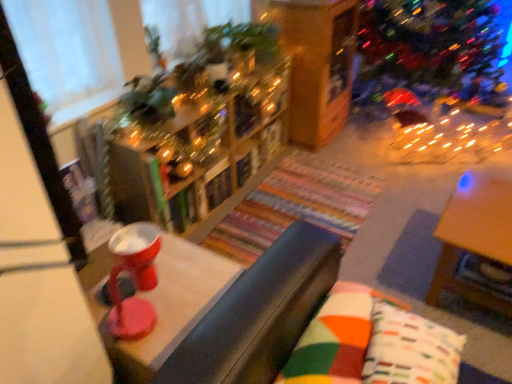
Find the location of a particular element. This screenshot has width=512, height=384. shiny plastic bowl at center, the 2th table in the right-to-left sequence is located at coordinates (160, 302).

Describe the element at coordinates (160, 302) in the screenshot. I see `shiny plastic bowl at center, the 2th table in the right-to-left sequence` at that location.

The height and width of the screenshot is (384, 512). What do you see at coordinates (317, 65) in the screenshot?
I see `wooden bookshelf at center` at bounding box center [317, 65].

In order to face multicolored fabric pillow at lower right, which ranks as the 2th pillow in left-to-right order, should I rotate leftwards or rightwards?

To face it directly, rotate right by 21.220 degrees.

Locate an element on the screen. wooden table at right, acting as the 2th table starting from the left is located at coordinates (475, 235).

What is the approximate width of wooden table at right, the 1th table when ordered from right to left?

The width of wooden table at right, the 1th table when ordered from right to left, is 54.92 centimeters.

The width and height of the screenshot is (512, 384). Identify the location of shiny plastic bowl at center, the 1th table when ordered from left to right. (160, 302).

Is multicolored fabric pillow at lower right, which ranks as the 2th pillow in left-to-right order, oriented away from shiny plastic bowl at center, the 1th table when ordered from left to right?

Yes, multicolored fabric pillow at lower right, which ranks as the 2th pillow in left-to-right order,'s orientation is away from shiny plastic bowl at center, the 1th table when ordered from left to right.

What are the coordinates of `table on the left of multicolored fabric pillow at lower right, which ranks as the 2th pillow in left-to-right order` in the screenshot? It's located at (160, 302).

Does multicolored fabric pillow at lower right, which ranks as the 2th pillow in left-to-right order, come behind shiny plastic bowl at center, the 1th table when ordered from left to right?

No, the depth of multicolored fabric pillow at lower right, which ranks as the 2th pillow in left-to-right order, is less than that of shiny plastic bowl at center, the 1th table when ordered from left to right.

Considering the sizes of multicolored fabric pillow at lower right, acting as the first pillow starting from the right, and shiny plastic bowl at center, the 1th table when ordered from left to right, in the image, is multicolored fabric pillow at lower right, acting as the first pillow starting from the right, wider or thinner than shiny plastic bowl at center, the 1th table when ordered from left to right,?

Considering their sizes, multicolored fabric pillow at lower right, acting as the first pillow starting from the right, looks slimmer than shiny plastic bowl at center, the 1th table when ordered from left to right.

The width and height of the screenshot is (512, 384). Identify the location of the 2nd table below when counting from the wooden bookshelf at center (from the image's perspective). (160, 302).

Is wooden bookshelf at center far away from shiny plastic bowl at center, the 1th table when ordered from left to right?

No.

Can you confirm if wooden bookshelf at center is bigger than shiny plastic bowl at center, the 2th table in the right-to-left sequence?

Incorrect, wooden bookshelf at center is not larger than shiny plastic bowl at center, the 2th table in the right-to-left sequence.

What's the angular difference between shiny plastic bowl at center, the 1th table when ordered from left to right, and wooden bookshelf at center's facing directions?

They differ by 92.5 degrees in their facing directions.

In the scene shown: Is the depth of shiny plastic bowl at center, the 2th table in the right-to-left sequence, less than that of wooden bookshelf at center?

Yes, it is.

Considering the relative sizes of shiny plastic bowl at center, the 1th table when ordered from left to right, and wooden bookshelf at center in the image provided, is shiny plastic bowl at center, the 1th table when ordered from left to right, smaller than wooden bookshelf at center?

Yes.

From a real-world perspective, relative to wooden bookshelf at center, is shiny plastic bowl at center, the 1th table when ordered from left to right, vertically above or below?

Clearly, from a real-world perspective, shiny plastic bowl at center, the 1th table when ordered from left to right, is below wooden bookshelf at center.

Which point is more forward, (x=314, y=10) or (x=465, y=220)?

The point (x=465, y=220) is in front.

From their relative heights in the image, would you say wooden bookshelf at center is taller or shorter than wooden table at right, acting as the 2th table starting from the left?

In the image, wooden bookshelf at center appears to be taller than wooden table at right, acting as the 2th table starting from the left.

From the picture: What's the angular difference between wooden bookshelf at center and wooden table at right, acting as the 2th table starting from the left,'s facing directions?

The angle between the facing direction of wooden bookshelf at center and the facing direction of wooden table at right, acting as the 2th table starting from the left, is 91.3 degrees.

From the picture: Is wooden bookshelf at center facing towards wooden table at right, acting as the 2th table starting from the left?

No, wooden bookshelf at center does not turn towards wooden table at right, acting as the 2th table starting from the left.

Does multicolored fabric pillow at center, which is the second pillow in right-to-left order, come behind multicolored fabric pillow at lower right, which ranks as the 2th pillow in left-to-right order?

Yes, it is.

Who is bigger, multicolored fabric pillow at center, the 1th pillow positioned from the left, or multicolored fabric pillow at lower right, which ranks as the 2th pillow in left-to-right order?

multicolored fabric pillow at center, the 1th pillow positioned from the left.

Considering the sizes of objects multicolored fabric pillow at center, the 1th pillow positioned from the left, and multicolored fabric pillow at lower right, which ranks as the 2th pillow in left-to-right order, in the image provided, who is thinner, multicolored fabric pillow at center, the 1th pillow positioned from the left, or multicolored fabric pillow at lower right, which ranks as the 2th pillow in left-to-right order,?

With smaller width is multicolored fabric pillow at center, the 1th pillow positioned from the left.

Locate an element on the screen. The width and height of the screenshot is (512, 384). pillow below the multicolored fabric pillow at lower right, acting as the first pillow starting from the right (from a real-world perspective) is located at coordinates (336, 338).

How much distance is there between multicolored fabric pillow at lower right, acting as the first pillow starting from the right, and wooden bookshelf at center?

The distance of multicolored fabric pillow at lower right, acting as the first pillow starting from the right, from wooden bookshelf at center is 1.82 meters.

Is multicolored fabric pillow at lower right, acting as the first pillow starting from the right, taller or shorter than wooden bookshelf at center?

In the image, multicolored fabric pillow at lower right, acting as the first pillow starting from the right, appears to be shorter than wooden bookshelf at center.

From the image's perspective, which is below, multicolored fabric pillow at lower right, acting as the first pillow starting from the right, or wooden bookshelf at center?

multicolored fabric pillow at lower right, acting as the first pillow starting from the right, from the image's perspective.

This screenshot has height=384, width=512. Identify the location of shelf behind the multicolored fabric pillow at lower right, which ranks as the 2th pillow in left-to-right order. (317, 65).

Considering the points (145, 184) and (323, 102), which point is in front, point (145, 184) or point (323, 102)?

The point (145, 184) is more forward.

Is wooden bookshelf at center next to wooden bookshelf at center and touching it?

wooden bookshelf at center is not next to wooden bookshelf at center, and they're not touching.

How far apart are wooden bookshelf at center and wooden bookshelf at center?

wooden bookshelf at center and wooden bookshelf at center are 20.49 inches apart from each other.

In terms of width, does wooden bookshelf at center look wider or thinner when compared to wooden bookshelf at center?

In the image, wooden bookshelf at center appears to be more narrow than wooden bookshelf at center.

In order to click on table that is the 1st object located behind the multicolored fabric pillow at lower right, which ranks as the 2th pillow in left-to-right order in this screenshot , I will do `click(160, 302)`.

You are a GUI agent. You are given a task and a screenshot of the screen. Output one action in this format:
    pyautogui.click(x=<x>, y=<y>)
    Task: Click on the table on the left of wooden bookshelf at center
    The width and height of the screenshot is (512, 384).
    Given the screenshot: What is the action you would take?
    pyautogui.click(x=160, y=302)

Looking at the image, which one is located closer to shiny plastic bowl at center, the 1th table when ordered from left to right, wooden table at right, acting as the 2th table starting from the left, or multicolored fabric pillow at lower right, which ranks as the 2th pillow in left-to-right order?

Based on the image, multicolored fabric pillow at lower right, which ranks as the 2th pillow in left-to-right order, appears to be nearer to shiny plastic bowl at center, the 1th table when ordered from left to right.

Looking at the image, which one is located closer to wooden bookshelf at center, multicolored fabric pillow at lower right, acting as the first pillow starting from the right, or multicolored fabric pillow at center, the 1th pillow positioned from the left?

Based on the image, multicolored fabric pillow at center, the 1th pillow positioned from the left, appears to be nearer to wooden bookshelf at center.

Based on their spatial positions, is multicolored fabric pillow at center, which is the second pillow in right-to-left order, or multicolored fabric pillow at lower right, which ranks as the 2th pillow in left-to-right order, closer to shiny plastic bowl at center, the 2th table in the right-to-left sequence?

multicolored fabric pillow at center, which is the second pillow in right-to-left order, is closer to shiny plastic bowl at center, the 2th table in the right-to-left sequence.

When comparing their distances from shiny plastic bowl at center, the 1th table when ordered from left to right, does wooden table at right, acting as the 2th table starting from the left, or multicolored fabric pillow at center, which is the second pillow in right-to-left order, seem further?

wooden table at right, acting as the 2th table starting from the left, is further to shiny plastic bowl at center, the 1th table when ordered from left to right.

Consider the image. When comparing their distances from wooden bookshelf at center, does shiny plastic bowl at center, the 1th table when ordered from left to right, or multicolored fabric pillow at lower right, acting as the first pillow starting from the right, seem further?

multicolored fabric pillow at lower right, acting as the first pillow starting from the right, is positioned further to the anchor wooden bookshelf at center.

Considering their positions, is multicolored fabric pillow at lower right, acting as the first pillow starting from the right, positioned further to wooden bookshelf at center than wooden table at right, acting as the 2th table starting from the left?

multicolored fabric pillow at lower right, acting as the first pillow starting from the right, is positioned further to the anchor wooden bookshelf at center.

From the image, which object appears to be farther from wooden bookshelf at center, wooden table at right, the 1th table when ordered from right to left, or multicolored fabric pillow at center, the 1th pillow positioned from the left?

multicolored fabric pillow at center, the 1th pillow positioned from the left, is further to wooden bookshelf at center.

Which object lies nearer to the anchor point wooden table at right, the 1th table when ordered from right to left, wooden bookshelf at center or wooden bookshelf at center?

The object closer to wooden table at right, the 1th table when ordered from right to left, is wooden bookshelf at center.

This screenshot has height=384, width=512. Find the location of `table between wooden bookshelf at center and multicolored fabric pillow at center, which is the second pillow in right-to-left order, in the up-down direction`. table between wooden bookshelf at center and multicolored fabric pillow at center, which is the second pillow in right-to-left order, in the up-down direction is located at coordinates pyautogui.click(x=475, y=235).

The width and height of the screenshot is (512, 384). What are the coordinates of `shelf between wooden bookshelf at center and wooden table at right, the 1th table when ordered from right to left, in the horizontal direction` in the screenshot? It's located at (317, 65).

You are a GUI agent. You are given a task and a screenshot of the screen. Output one action in this format:
    pyautogui.click(x=<x>, y=<y>)
    Task: Click on the pillow between wooden bookshelf at center and multicolored fabric pillow at lower right, acting as the first pillow starting from the right, in the up-down direction
    This screenshot has width=512, height=384.
    Given the screenshot: What is the action you would take?
    pyautogui.click(x=336, y=338)

The height and width of the screenshot is (384, 512). Find the location of `pillow between shiny plastic bowl at center, the 1th table when ordered from left to right, and multicolored fabric pillow at lower right, acting as the first pillow starting from the right, in the horizontal direction`. pillow between shiny plastic bowl at center, the 1th table when ordered from left to right, and multicolored fabric pillow at lower right, acting as the first pillow starting from the right, in the horizontal direction is located at coordinates (336, 338).